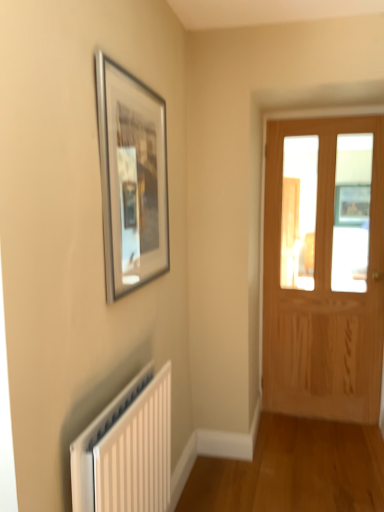
Describe the element at coordinates (131, 178) in the screenshot. The height and width of the screenshot is (512, 384). I see `silver metallic picture frame at upper left` at that location.

Measure the distance between point (166, 409) and camera.

The distance of point (166, 409) from camera is 1.72 meters.

This screenshot has height=512, width=384. I want to click on silver metallic picture frame at upper left, so click(131, 178).

In order to click on door below the silver metallic picture frame at upper left (from a real-world perspective) in this screenshot , I will do `click(324, 268)`.

From the image's perspective, is light brown wooden door at right below silver metallic picture frame at upper left?

Yes, from the image's perspective, light brown wooden door at right is beneath silver metallic picture frame at upper left.

Between light brown wooden door at right and silver metallic picture frame at upper left, which one is positioned in front?

silver metallic picture frame at upper left is more forward.

From the image's perspective, relative to white plastic radiator at lower left, is silver metallic picture frame at upper left above or below?

Clearly, from the image's perspective, silver metallic picture frame at upper left is above white plastic radiator at lower left.

Is silver metallic picture frame at upper left oriented towards white plastic radiator at lower left?

No, silver metallic picture frame at upper left is not oriented towards white plastic radiator at lower left.

From a real-world perspective, is silver metallic picture frame at upper left under white plastic radiator at lower left?

No, from a real-world perspective, silver metallic picture frame at upper left is not below white plastic radiator at lower left.

Is white plastic radiator at lower left surrounded by silver metallic picture frame at upper left?

No, white plastic radiator at lower left is not inside silver metallic picture frame at upper left.

Is silver metallic picture frame at upper left wider than light brown wooden door at right?

No.

Considering the relative sizes of silver metallic picture frame at upper left and light brown wooden door at right in the image provided, is silver metallic picture frame at upper left bigger than light brown wooden door at right?

Actually, silver metallic picture frame at upper left might be smaller than light brown wooden door at right.

Does point (159, 213) lie in front of point (333, 192)?

That is True.

From the image's perspective, is silver metallic picture frame at upper left on top of light brown wooden door at right?

Yes, from the image's perspective, silver metallic picture frame at upper left is on top of light brown wooden door at right.

Is white plastic radiator at lower left taller or shorter than silver metallic picture frame at upper left?

In the image, white plastic radiator at lower left appears to be shorter than silver metallic picture frame at upper left.

Considering the sizes of objects white plastic radiator at lower left and silver metallic picture frame at upper left in the image provided, who is smaller, white plastic radiator at lower left or silver metallic picture frame at upper left?

silver metallic picture frame at upper left.

Is point (114, 455) farther from viewer compared to point (111, 65)?

No, it is in front of (111, 65).

From the image's perspective, is white plastic radiator at lower left above or below silver metallic picture frame at upper left?

From the image's perspective, white plastic radiator at lower left appears below silver metallic picture frame at upper left.

Which object is more forward, light brown wooden door at right or white plastic radiator at lower left?

white plastic radiator at lower left is more forward.

In the scene shown: Is light brown wooden door at right positioned with its back to white plastic radiator at lower left?

No, light brown wooden door at right's orientation is not away from white plastic radiator at lower left.

Which of these two, light brown wooden door at right or white plastic radiator at lower left, is bigger?

With larger size is light brown wooden door at right.

Would you say light brown wooden door at right is outside white plastic radiator at lower left?

Yes, light brown wooden door at right is not within white plastic radiator at lower left.

What's the angular difference between white plastic radiator at lower left and light brown wooden door at right's facing directions?

The angular difference between white plastic radiator at lower left and light brown wooden door at right is 88.9 degrees.

Relative to light brown wooden door at right, is white plastic radiator at lower left in front or behind?

white plastic radiator at lower left is in front of light brown wooden door at right.

Is white plastic radiator at lower left facing away from light brown wooden door at right?

No, white plastic radiator at lower left is not facing the opposite direction of light brown wooden door at right.

From the image's perspective, relative to light brown wooden door at right, is white plastic radiator at lower left above or below?

Based on their image positions, white plastic radiator at lower left is located beneath light brown wooden door at right.

Where is `door behind the silver metallic picture frame at upper left`? The image size is (384, 512). door behind the silver metallic picture frame at upper left is located at coordinates (324, 268).

Find the location of a particular element. picture frame above the white plastic radiator at lower left (from the image's perspective) is located at coordinates (131, 178).

Considering their positions, is white plastic radiator at lower left positioned closer to silver metallic picture frame at upper left than light brown wooden door at right?

white plastic radiator at lower left is positioned closer to the anchor silver metallic picture frame at upper left.

From the image, which object appears to be farther from light brown wooden door at right, white plastic radiator at lower left or silver metallic picture frame at upper left?

white plastic radiator at lower left.

Which object lies nearer to the anchor point silver metallic picture frame at upper left, light brown wooden door at right or white plastic radiator at lower left?

white plastic radiator at lower left is closer to silver metallic picture frame at upper left.

Estimate the real-world distances between objects in this image. Which object is further from light brown wooden door at right, silver metallic picture frame at upper left or white plastic radiator at lower left?

white plastic radiator at lower left is further to light brown wooden door at right.

When comparing their distances from white plastic radiator at lower left, does silver metallic picture frame at upper left or light brown wooden door at right seem further?

light brown wooden door at right.

Which object lies nearer to the anchor point white plastic radiator at lower left, light brown wooden door at right or silver metallic picture frame at upper left?

silver metallic picture frame at upper left is positioned closer to the anchor white plastic radiator at lower left.

Locate an element on the screen. The image size is (384, 512). picture frame between white plastic radiator at lower left and light brown wooden door at right in the front-back direction is located at coordinates (131, 178).